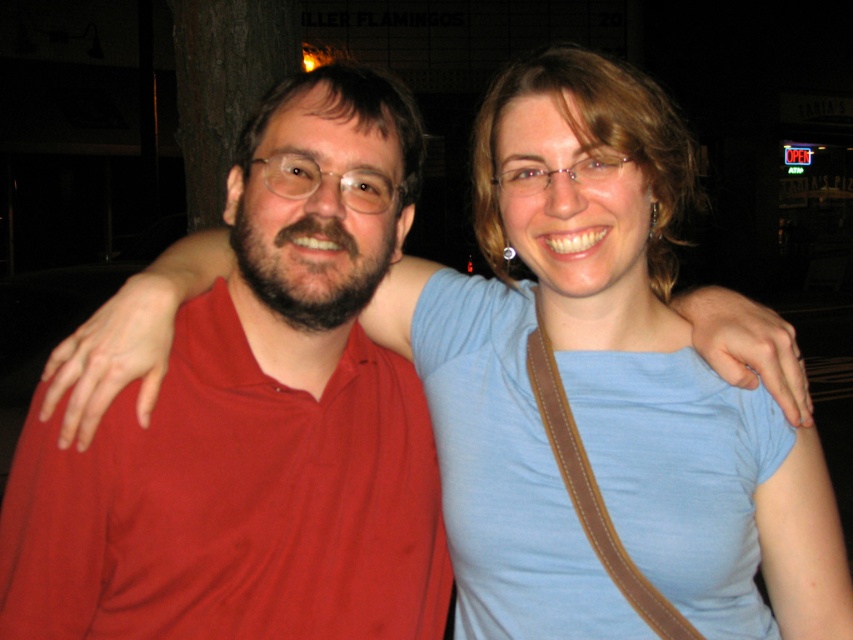
You are taking a photo of two people standing in a dark area. You notice two points of light in the image at coordinates point (494, 412) and point (67, 532). Which point is closer to the camera?

Point (494, 412) is further to the camera than point (67, 532), so the point closer to the camera is point (67, 532).

You are a photographer adjusting your camera settings to capture the scene. You need to focus on the blue cotton shirt at upper right and the matte red shirt at left. Which shirt should you focus on first to ensure both are in sharp focus?

You should focus on the blue cotton shirt at upper right first because it is closer to the viewer than the matte red shirt at left. By focusing on the closer object, the depth of field may help keep both in focus.

You are taking a photo of two people at night. The person on the left is wearing a red shirt and the person on the right is wearing a blue cotton shirt at upper right. Based on their positions, which shirt is closer to the camera?

The blue cotton shirt at upper right is located at point (x=606, y=396), which is closer to the camera compared to the red shirt on the left.